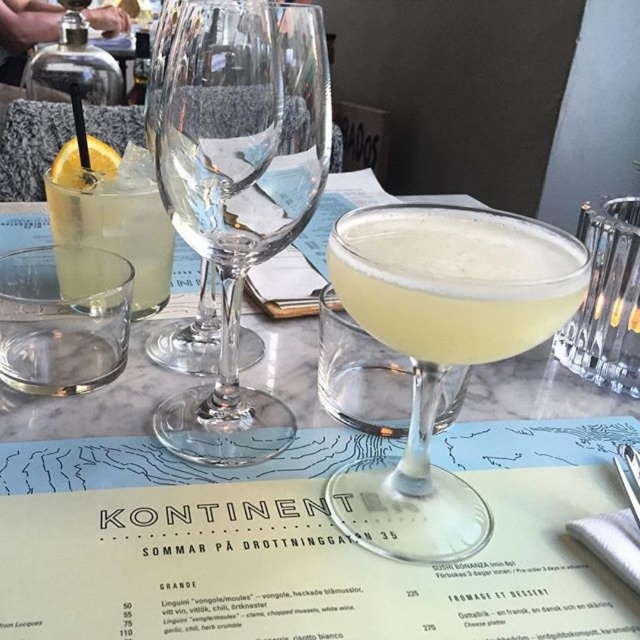
Question: Which point appears farthest from the camera in this image?

Choices:
 (A) (419, 259)
 (B) (387, 257)

Answer: (B)

Question: Based on their relative distances, which object is farther from the translucent glass at left?

Choices:
 (A) matte yellow cocktail at center
 (B) clear glass cocktail at center
 (C) transparent glass wine glass at center

Answer: (A)

Question: Can you confirm if transparent glass wine glass at center is thinner than translucent glass cocktail at center?

Choices:
 (A) no
 (B) yes

Answer: (B)

Question: Can you confirm if transparent glass wine glass at center is smaller than translucent glass cocktail at center?

Choices:
 (A) no
 (B) yes

Answer: (A)

Question: Among these points, which one is farthest from the camera?

Choices:
 (A) (275, 131)
 (B) (483, 618)
 (C) (464, 256)

Answer: (A)

Question: Does clear glass cocktail at center lie in front of translucent glass cocktail at center?

Choices:
 (A) no
 (B) yes

Answer: (A)